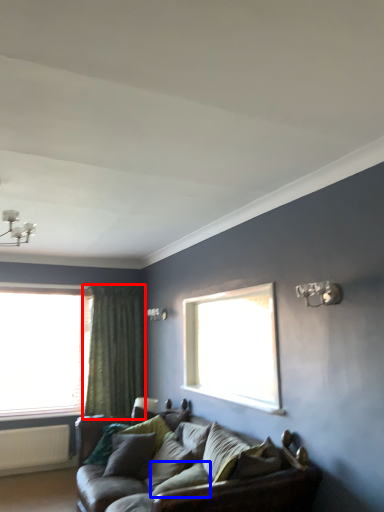
Question: Which object appears farthest to the camera in this image, curtain (highlighted by a red box) or pillow (highlighted by a blue box)?

Choices:
 (A) curtain
 (B) pillow

Answer: (A)